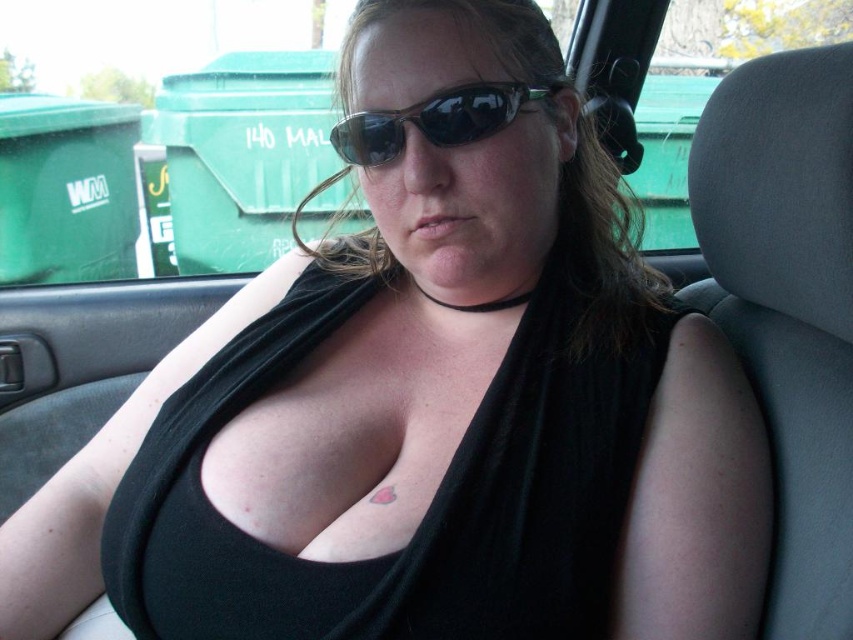
What is the exact position of the black fabric bikini top at center in the image?

The black fabric bikini top at center is located at point 0.783 on the x axis and 0.506 on the y axis.

You are a photographer taking a photo of the black fabric bikini top at center and the black plastic sunglasses at center through the car window. Which object should you focus on first to ensure both are in focus?

The black fabric bikini top at center is closer to the viewer than the black plastic sunglasses at center, so focus on the black fabric bikini top at center first to ensure both are in focus.

Looking at this image, you are a fashion designer observing a model wearing the black fabric bikini top at center and the black plastic sunglasses at center. Which item is positioned lower on the model?

The black fabric bikini top at center is positioned below the black plastic sunglasses at center, so the bikini top is lower.